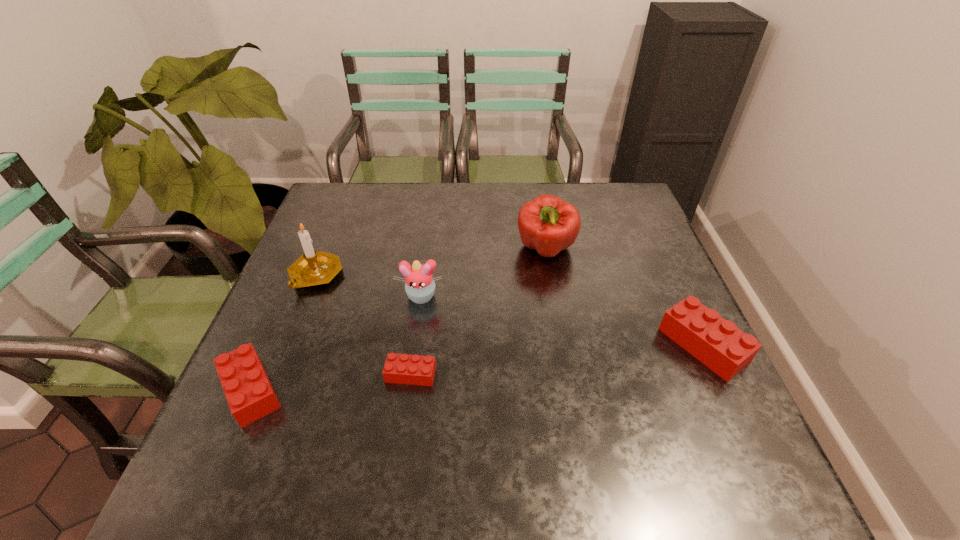
At what (x,y) coordinates should I click in order to perform the action: click on blank region between the fifth object from left to right and the second shortest object. Please return your answer as a coordinate pair (x, y). The height and width of the screenshot is (540, 960). Looking at the image, I should click on (398, 320).

Where is `free space between the rightmost object and the candle holder`? free space between the rightmost object and the candle holder is located at coordinates (510, 310).

You are a GUI agent. You are given a task and a screenshot of the screen. Output one action in this format:
    pyautogui.click(x=<x>, y=<y>)
    Task: Click on the free space between the cupcake and the rightmost Lego
    Image resolution: width=960 pixels, height=540 pixels.
    Given the screenshot: What is the action you would take?
    pyautogui.click(x=562, y=321)

Image resolution: width=960 pixels, height=540 pixels. In order to click on free space that is in between the rightmost object and the candle holder in this screenshot , I will do (510, 310).

Select which object is the second closest to the second object from right to left. Please provide its 2D coordinates. Your answer should be formatted as a tuple, i.e. [(x, y)], where the tuple contains the x and y coordinates of a point satisfying the conditions above.

[(717, 343)]

You are a GUI agent. You are given a task and a screenshot of the screen. Output one action in this format:
    pyautogui.click(x=<x>, y=<y>)
    Task: Click on the object that stands as the closest to the candle holder
    The image size is (960, 540).
    Given the screenshot: What is the action you would take?
    pyautogui.click(x=419, y=285)

Find the location of a particular element. The image size is (960, 540). Lego that is the second closest to the cupcake is located at coordinates (250, 396).

I want to click on the closest Lego to the second tallest Lego, so click(x=399, y=368).

Where is `free space that satisfies the following two spatial constraints: 1. on the face of the rightmost object; 2. on the left side of the third tallest object`? The image size is (960, 540). free space that satisfies the following two spatial constraints: 1. on the face of the rightmost object; 2. on the left side of the third tallest object is located at coordinates (414, 345).

Where is `free space that satisfies the following two spatial constraints: 1. on the face of the rightmost object; 2. on the right side of the cupcake`? The height and width of the screenshot is (540, 960). free space that satisfies the following two spatial constraints: 1. on the face of the rightmost object; 2. on the right side of the cupcake is located at coordinates (414, 345).